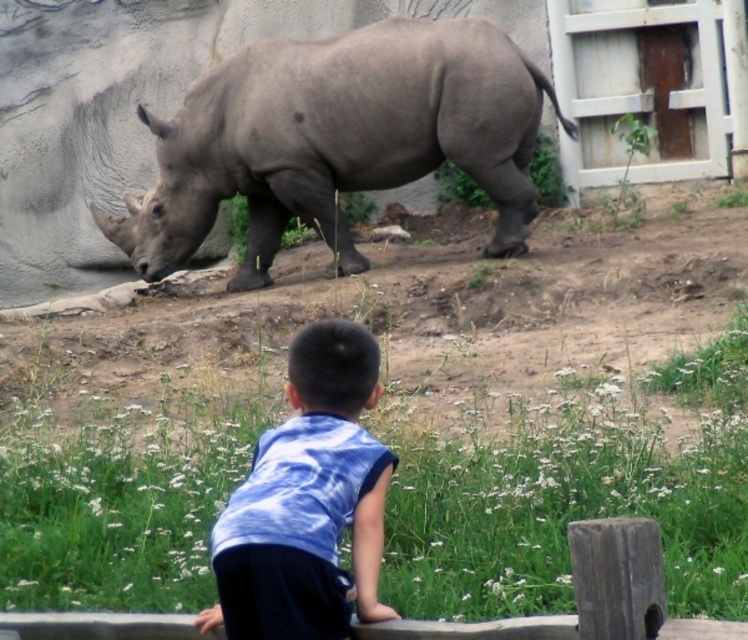
You are a zookeeper standing at the camera position. You need to feed the gray matte rhinoceros at upper center. The feeding tool you have can reach up to 30 feet. Can you reach the rhinoceros with your current tool?

The gray matte rhinoceros at upper center is 38.73 feet away from camera, which is farther than the feeding tool can reach. You need a longer tool to feed it.